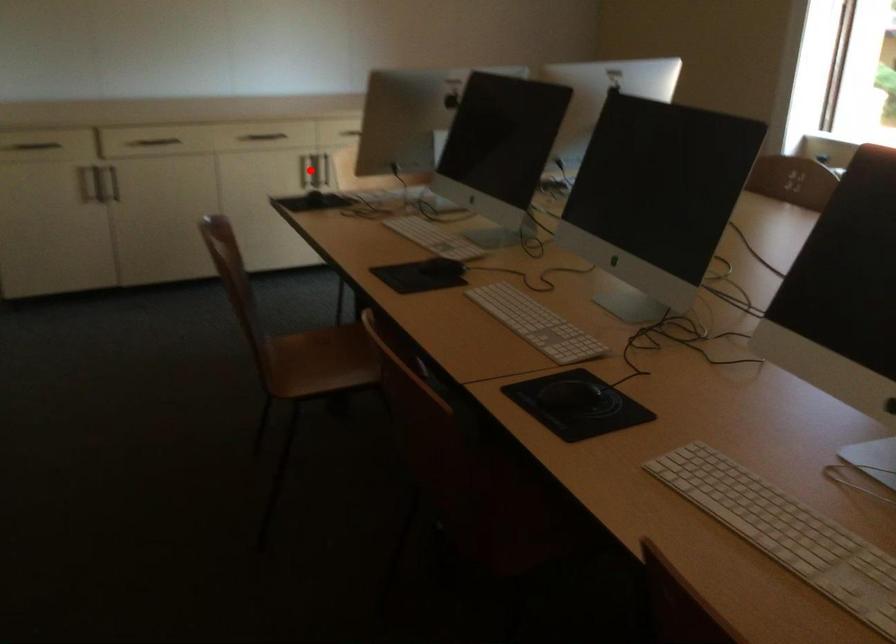
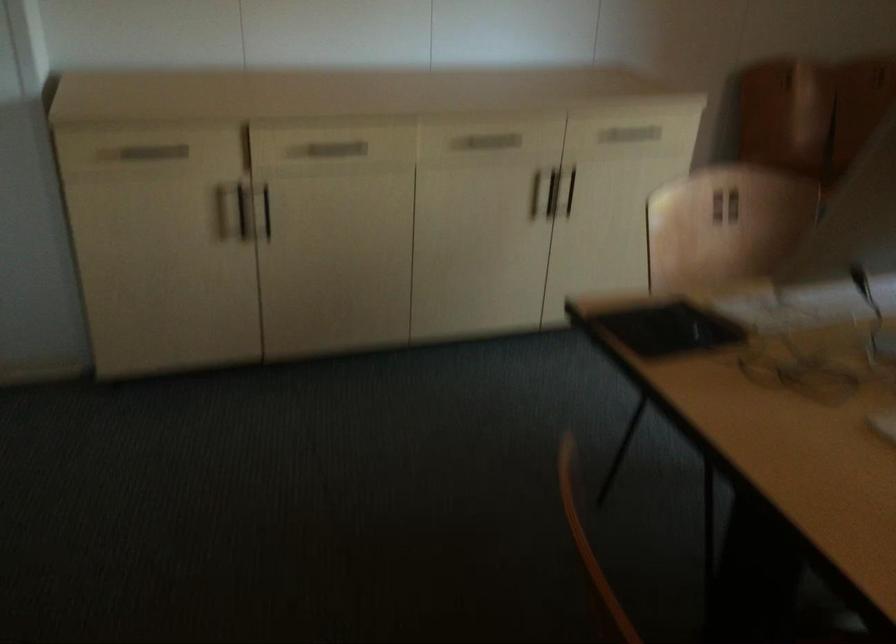
The point at the highlighted location is marked in the first image. Where is the corresponding point in the second image?

(552, 192)